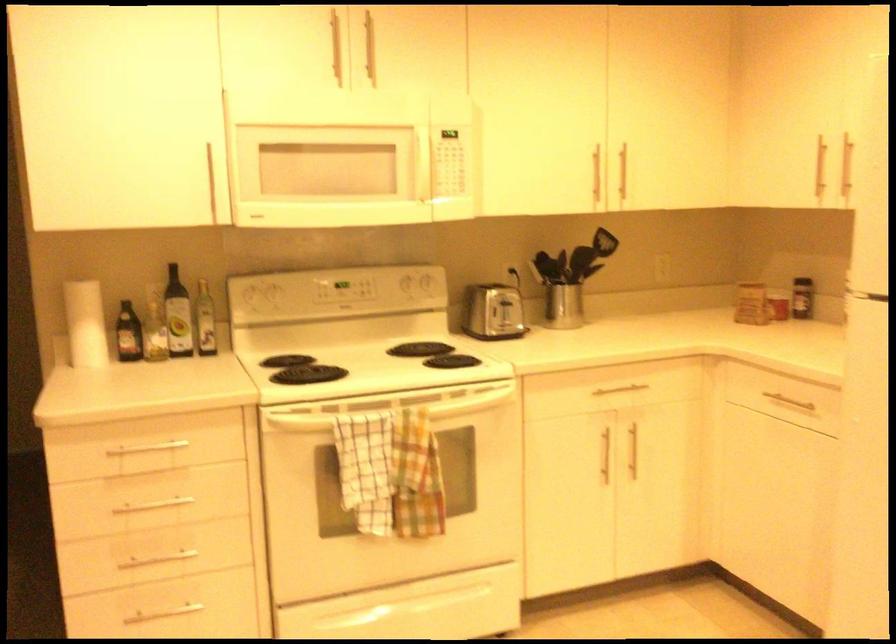
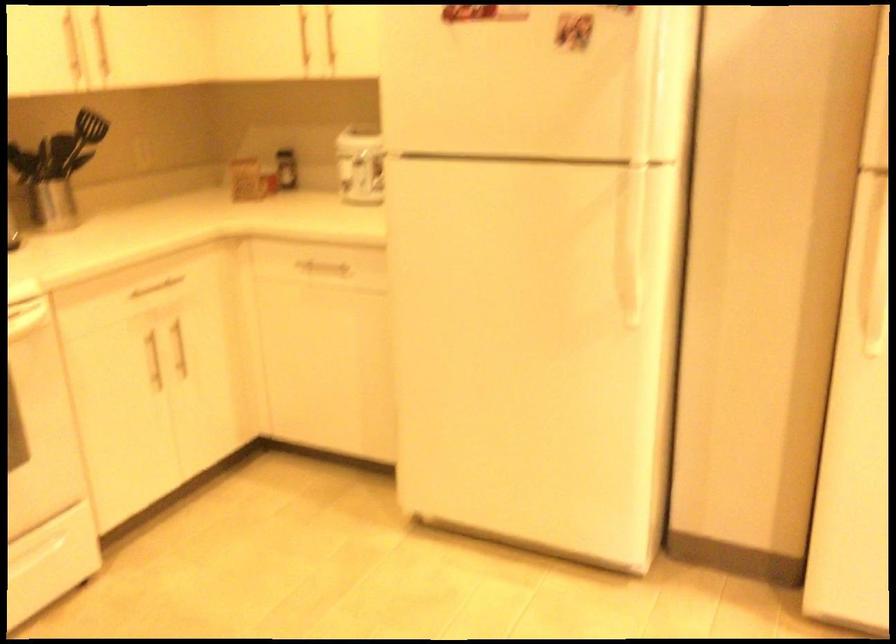
The point at (794,402) is marked in the first image. Where is the corresponding point in the second image?

(323, 268)